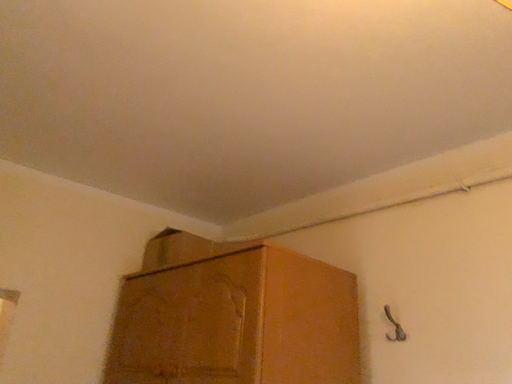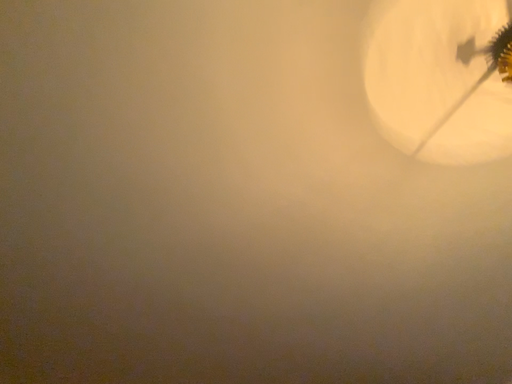
Question: How did the camera likely rotate when shooting the video?

Choices:
 (A) rotated downward
 (B) rotated upward

Answer: (B)